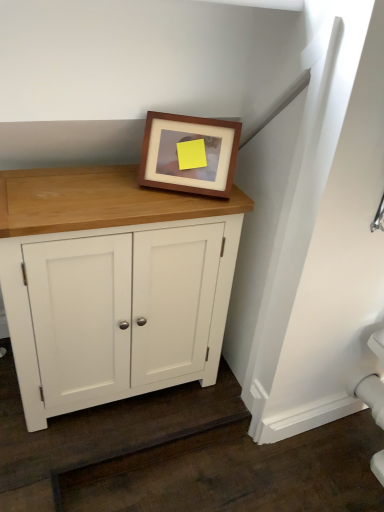
In order to click on empty space that is ontop of white wood cupboard at center (from a real-world perspective) in this screenshot , I will do `click(89, 189)`.